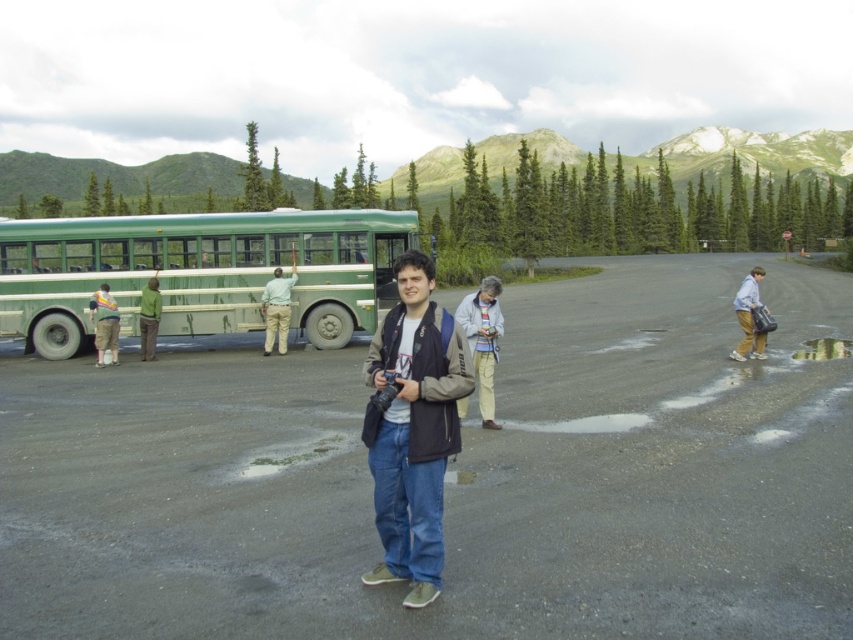
Question: Among these points, which one is farthest from the camera?

Choices:
 (A) (149, 356)
 (B) (836, 353)
 (C) (369, 580)
 (D) (740, 358)

Answer: (A)

Question: Does light blue denim jeans at right have a greater width compared to khaki pants at left?

Choices:
 (A) no
 (B) yes

Answer: (B)

Question: In this image, where is light blue denim jeans at right located relative to khaki pants at left?

Choices:
 (A) above
 (B) below

Answer: (A)

Question: Which of these objects is positioned closest to the dark asphalt parking lot at center?

Choices:
 (A) khaki pants at left
 (B) green matte bus at left
 (C) green fabric pants at left

Answer: (B)

Question: Which object is positioned closest to the denim jacket at center?

Choices:
 (A) light gray fabric jacket at center
 (B) transparent wet pavement at lower right
 (C) green matte bus at left
 (D) green matte shirt at left

Answer: (A)

Question: Is light blue denim jeans at right below green fabric pants at left?

Choices:
 (A) yes
 (B) no

Answer: (B)